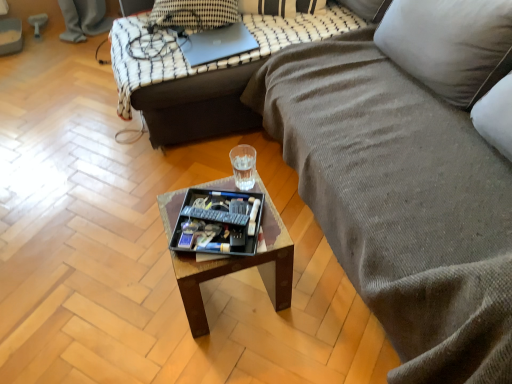
You are a GUI agent. You are given a task and a screenshot of the screen. Output one action in this format:
    pyautogui.click(x=<x>, y=<y>)
    Task: Click on the vacant region to the left of wooden tray at center
    The image size is (512, 384).
    Given the screenshot: What is the action you would take?
    tap(137, 298)